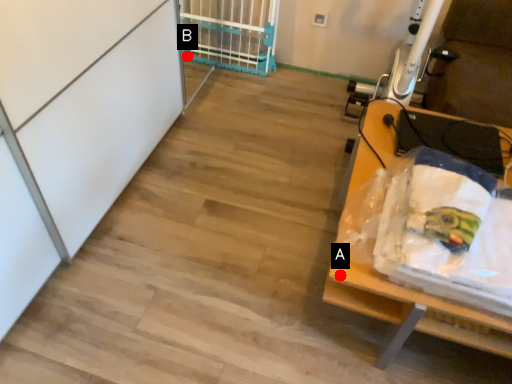
Question: Two points are circled on the image, labeled by A and B beside each circle. Which point is closer to the camera taking this photo?

Choices:
 (A) A is closer
 (B) B is closer

Answer: (A)